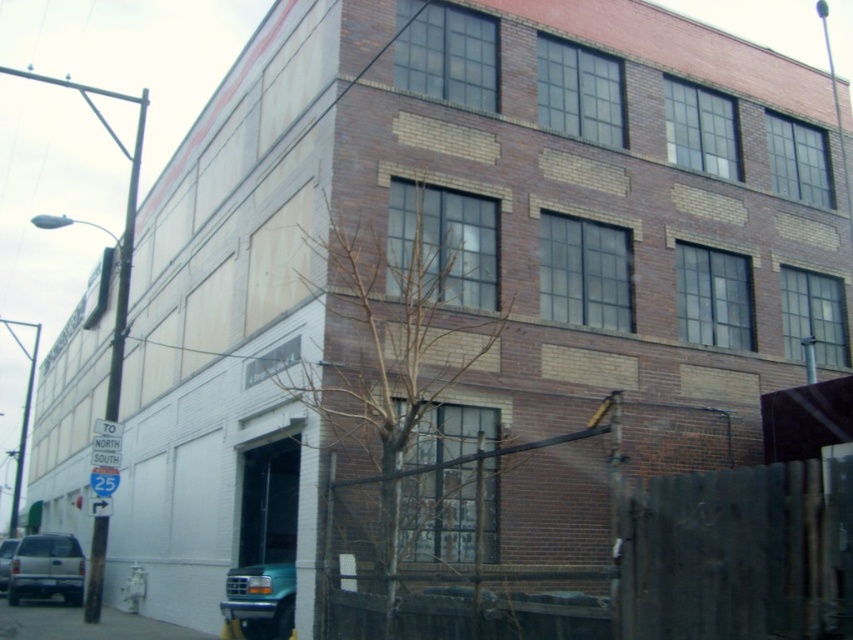
Question: Is matte silver suv at lower left bigger than teal matte truck at lower left?

Choices:
 (A) yes
 (B) no

Answer: (B)

Question: Which object is positioned farthest from the teal matte truck at lower left?

Choices:
 (A) brown wooden fence at lower right
 (B) matte silver suv at lower left

Answer: (A)

Question: Which object appears farthest from the camera in this image?

Choices:
 (A) teal matte truck at lower left
 (B) bare branches at center

Answer: (A)

Question: Among these points, which one is nearest to the camera?

Choices:
 (A) (36, 596)
 (B) (428, 362)
 (C) (18, 540)

Answer: (B)

Question: Is brown wooden fence at lower right smaller than matte silver suv at lower left?

Choices:
 (A) no
 (B) yes

Answer: (A)

Question: Is bare branches at center in front of brown wooden fence at lower right?

Choices:
 (A) yes
 (B) no

Answer: (B)